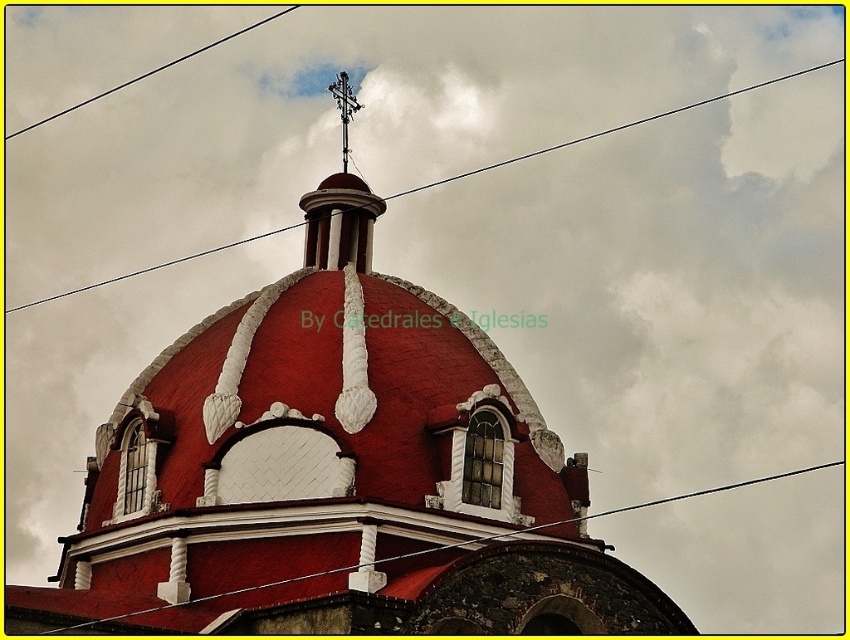
Question: Estimate the real-world distances between objects in this image. Which object is closer to the metallic wire at upper center?

Choices:
 (A) black wire at upper center
 (B) black wire at upper left

Answer: (A)

Question: Does black wire at upper center appear over black wire at upper left?

Choices:
 (A) no
 (B) yes

Answer: (A)

Question: Among these objects, which one is farthest from the camera?

Choices:
 (A) black wire at upper center
 (B) metallic wire at upper center
 (C) black wire at upper left

Answer: (C)

Question: Does metallic wire at upper center appear on the left side of black wire at upper left?

Choices:
 (A) no
 (B) yes

Answer: (A)

Question: Does black wire at upper center have a lesser width compared to black wire at upper left?

Choices:
 (A) no
 (B) yes

Answer: (A)

Question: Which object appears farthest from the camera in this image?

Choices:
 (A) metallic wire at upper center
 (B) black wire at upper left
 (C) black wire at upper center

Answer: (B)